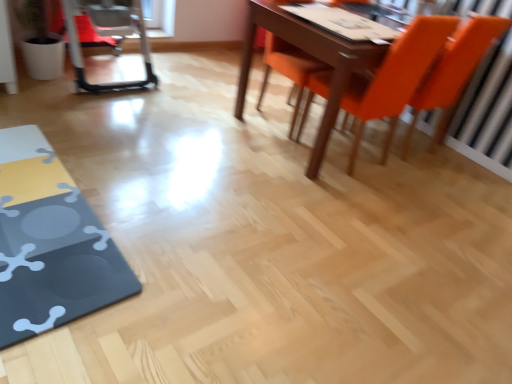
This screenshot has width=512, height=384. Find the location of `vacant area that lies between orange matte chair at upper right, acting as the second chair starting from the left, and metallic silver swivel chair at left`. vacant area that lies between orange matte chair at upper right, acting as the second chair starting from the left, and metallic silver swivel chair at left is located at coordinates (194, 107).